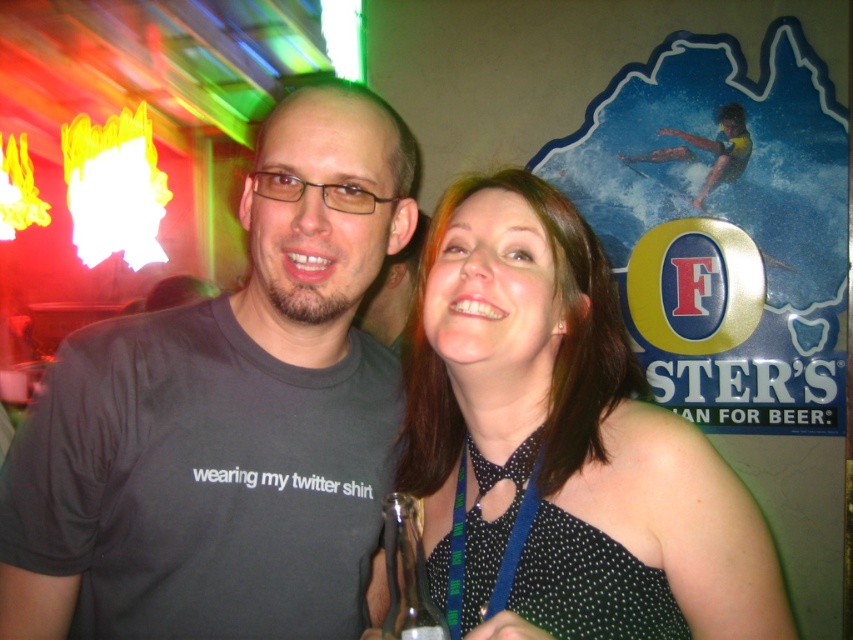
You are standing in the bar and want to take a photo of both the point at coordinates [380,392] and the point at coordinates [403,577]. Which point should you focus on first to ensure both are in frame?

You should focus on point [403,577] first because it is in front of point [380,392], so by centering on the front point, both points will be captured in the frame.

You are a photographer holding a camera and want to take a closeup shot of the black dotted dress at center. Based on the scene description, can you get a clear closeup without moving the camera or the dress?

The black dotted dress at center and camera are 22.64 inches apart. Since the distance is relatively short, you can get a clear closeup shot without needing to move either the camera or the dress.